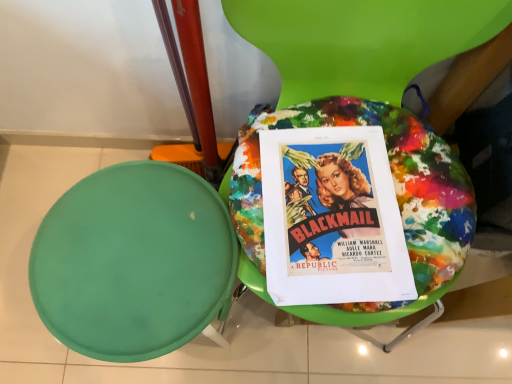
The width and height of the screenshot is (512, 384). Find the location of `free spot above vibrant paper poster at center (from a real-world perspective)`. free spot above vibrant paper poster at center (from a real-world perspective) is located at coordinates (334, 207).